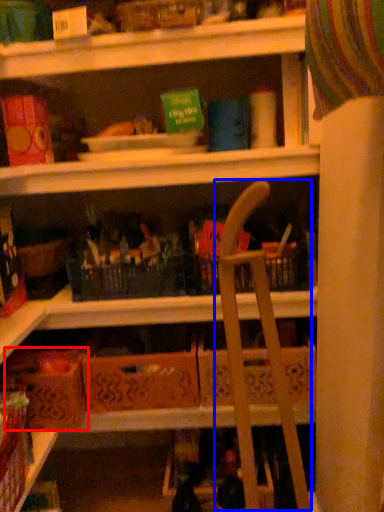
Question: Among these objects, which one is farthest to the camera, cardboard box (highlighted by a red box) or folding chair (highlighted by a blue box)?

Choices:
 (A) cardboard box
 (B) folding chair

Answer: (A)